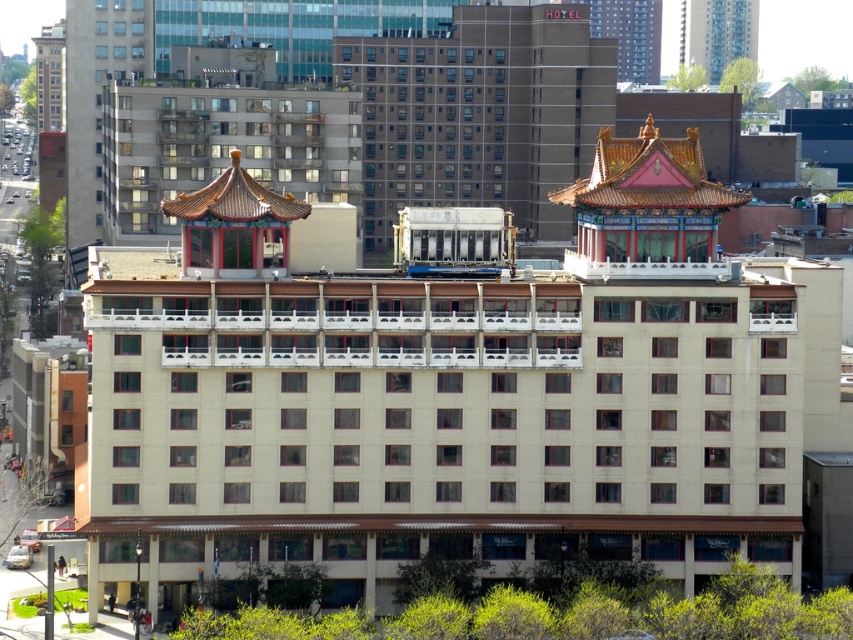
Question: Which object is farther from the camera taking this photo?

Choices:
 (A) beige concrete hotel at center
 (B) white matte building at center

Answer: (A)

Question: Where is white matte building at center located in relation to beige concrete hotel at center in the image?

Choices:
 (A) left
 (B) right

Answer: (B)

Question: Can you confirm if white matte building at center is positioned below beige concrete hotel at center?

Choices:
 (A) no
 (B) yes

Answer: (B)

Question: Which point is farther to the camera?

Choices:
 (A) beige concrete hotel at center
 (B) white matte building at center

Answer: (A)

Question: Is white matte building at center positioned before beige concrete hotel at center?

Choices:
 (A) yes
 (B) no

Answer: (A)